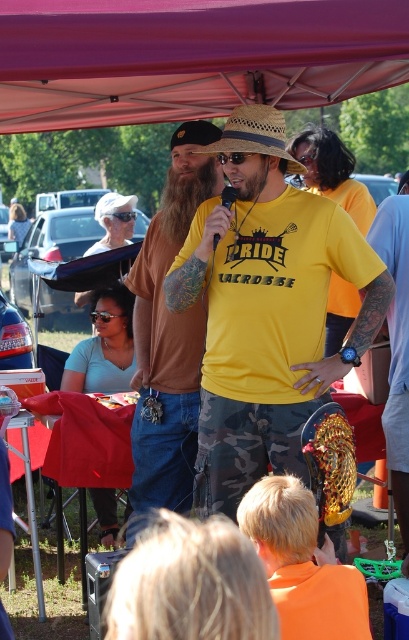
Who is taller, yellow matte t-shirt at center or beardsoft/hair-likeat center?

Standing taller between the two is yellow matte t-shirt at center.

Is yellow matte t-shirt at center closer to camera compared to beardsoft/hair-likeat center?

No, yellow matte t-shirt at center is further to the viewer.

The height and width of the screenshot is (640, 409). What are the coordinates of `yellow matte t-shirt at center` in the screenshot? It's located at (168, 337).

Find the location of a particular element. Image resolution: width=409 pixels, height=640 pixels. yellow matte t-shirt at center is located at coordinates 168,337.

Locate an element on the screen. strawhat at center is located at coordinates (254, 134).

Between point (289, 161) and point (181, 182), which one is positioned in front?

Point (289, 161) is in front.

What are the coordinates of `strawhat at center` in the screenshot? It's located at (254, 134).

Does yellow matte shirt at center have a smaller size compared to yellow matte t-shirt at center?

Incorrect, yellow matte shirt at center is not smaller in size than yellow matte t-shirt at center.

Is yellow matte shirt at center further to camera compared to yellow matte t-shirt at center?

No, yellow matte shirt at center is in front of yellow matte t-shirt at center.

This screenshot has width=409, height=640. What do you see at coordinates (267, 314) in the screenshot?
I see `yellow matte shirt at center` at bounding box center [267, 314].

You are a GUI agent. You are given a task and a screenshot of the screen. Output one action in this format:
    pyautogui.click(x=<x>, y=<y>)
    Task: Click on the yellow matte shirt at center
    The image size is (409, 640).
    Given the screenshot: What is the action you would take?
    pyautogui.click(x=267, y=314)